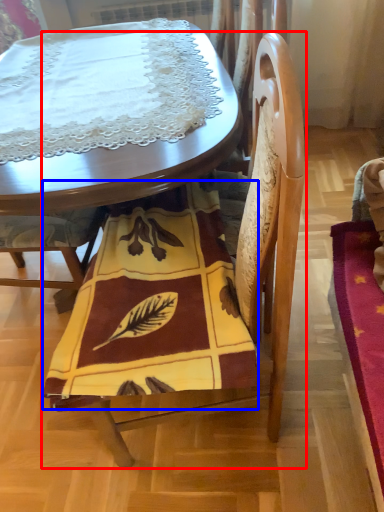
Question: Among these objects, which one is nearest to the camera, chair (highlighted by a red box) or blanket (highlighted by a blue box)?

Choices:
 (A) chair
 (B) blanket

Answer: (A)